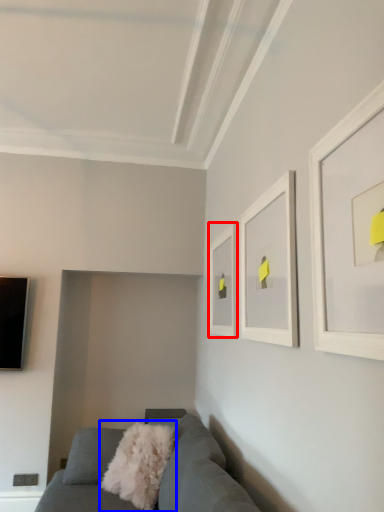
Question: Which object appears closest to the camera in this image, picture frame (highlighted by a red box) or throw pillow (highlighted by a blue box)?

Choices:
 (A) picture frame
 (B) throw pillow

Answer: (B)